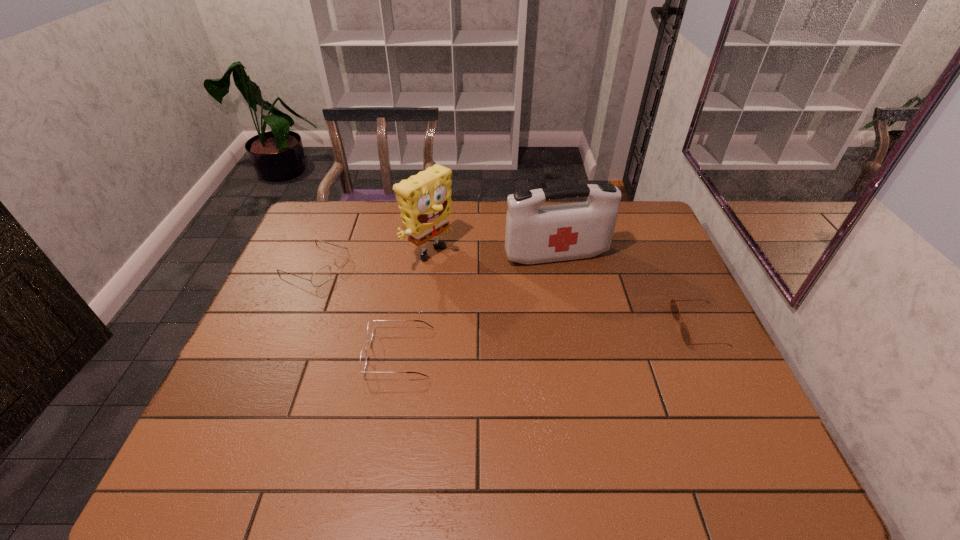
Where is `the right spectacles`? the right spectacles is located at coordinates (363, 356).

The image size is (960, 540). I want to click on the rightmost object, so click(685, 333).

Identify the location of sunglasses. This screenshot has width=960, height=540. (685, 333).

The image size is (960, 540). Identify the location of sponge. pos(424,200).

Locate an element on the screen. the first-aid kit is located at coordinates (534, 234).

Locate an element on the screen. the leftmost object is located at coordinates (322, 275).

Locate an element on the screen. The image size is (960, 540). the farther spectacles is located at coordinates (322, 275).

Image resolution: width=960 pixels, height=540 pixels. Find the location of `free space located on the front-facing side of the nearer spectacles`. free space located on the front-facing side of the nearer spectacles is located at coordinates (309, 353).

Find the location of a particular element. Image resolution: width=960 pixels, height=540 pixels. free space located on the front-facing side of the nearer spectacles is located at coordinates (252, 353).

At what (x,y) coordinates should I click in order to perform the action: click on vacant region located on the front-facing side of the nearer spectacles. Please return your answer as a coordinate pair (x, y). Image resolution: width=960 pixels, height=540 pixels. Looking at the image, I should click on (282, 353).